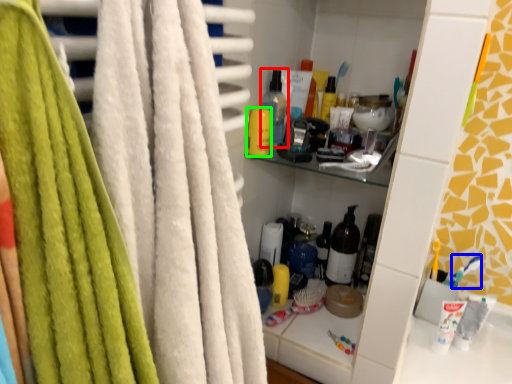
Question: Which object is the closest to the bottle (highlighted by a red box)? Choose among these: toothbrush (highlighted by a blue box) or toiletry (highlighted by a green box).

Choices:
 (A) toothbrush
 (B) toiletry

Answer: (B)